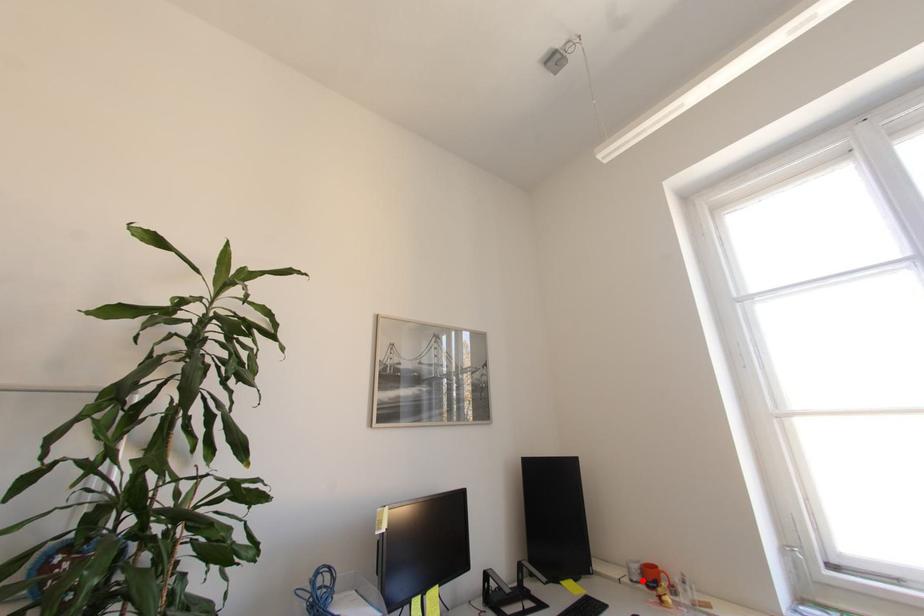
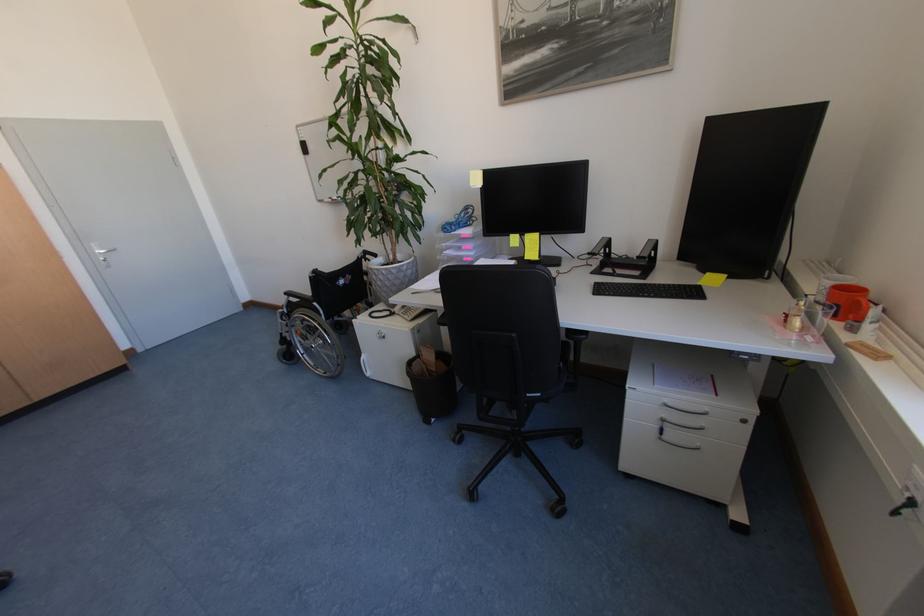
In the second image, find the point that corresponds to the highlighted location in the first image.

(824, 300)